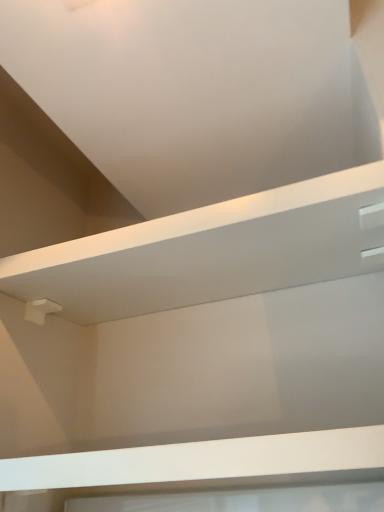
Measure the distance between point [319,258] and camera.

28.43 inches.

What is the approximate width of white glossy shelf at upper center?

12.73 inches.

What do you see at coordinates (213, 251) in the screenshot?
I see `white glossy shelf at upper center` at bounding box center [213, 251].

Measure the distance between white glossy shelf at upper center and camera.

white glossy shelf at upper center and camera are 20.70 inches apart from each other.

Locate an element on the screen. This screenshot has height=512, width=384. white glossy shelf at upper center is located at coordinates click(x=213, y=251).

At what (x,y) coordinates should I click in order to perform the action: click on white glossy shelf at upper center. Please return your answer as a coordinate pair (x, y). Looking at the image, I should click on (213, 251).